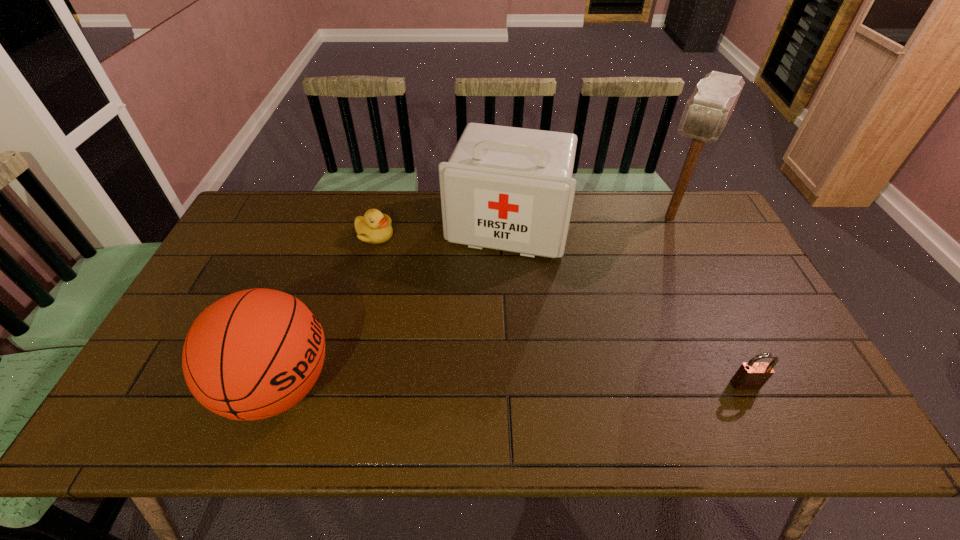
Locate an element on the screen. vacant space on the desktop that is between the basketball and the padlock and is positioned on the beak of the shortest object is located at coordinates (474, 386).

The width and height of the screenshot is (960, 540). In order to click on vacant space on the desktop that is between the third shortest object and the fourth tallest object and is positioned above the head of the mallet in this screenshot , I will do 577,385.

Locate an element on the screen. vacant space on the desktop that is between the third tallest object and the fourth tallest object and is positioned on the front-facing side of the third object from right to left is located at coordinates (461, 386).